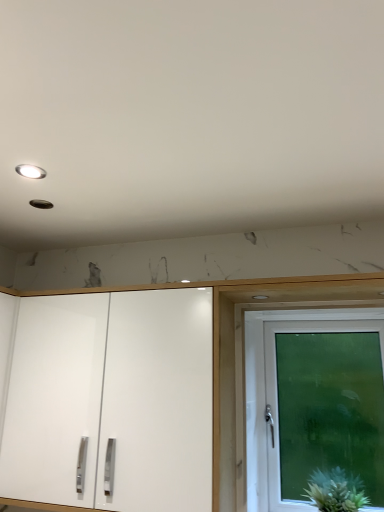
In order to face green fuzzy plant at lower right, should I rotate leftwards or rightwards?

Rotate your view right by about 18.816°.

This screenshot has height=512, width=384. In order to click on matte white light fixture at upper left in this screenshot , I will do `click(31, 170)`.

What are the coordinates of `white glass door at right` in the screenshot? It's located at (324, 405).

Does white glass door at right have a lesser width compared to matte white light fixture at upper left?

Incorrect, the width of white glass door at right is not less than that of matte white light fixture at upper left.

In the image, is white glass door at right on the left side or the right side of matte white light fixture at upper left?

Based on their positions, white glass door at right is located to the right of matte white light fixture at upper left.

Looking at the image, does white glass door at right seem bigger or smaller compared to matte white light fixture at upper left?

In the image, white glass door at right appears to be larger than matte white light fixture at upper left.

Would you say matte white light fixture at upper left is part of white glass door at right's contents?

No, matte white light fixture at upper left is located outside of white glass door at right.

Which object is more forward, green fuzzy plant at lower right or matte white light fixture at upper left?

matte white light fixture at upper left is in front.

From the image's perspective, relative to matte white light fixture at upper left, is green fuzzy plant at lower right above or below?

Clearly, from the image's perspective, green fuzzy plant at lower right is below matte white light fixture at upper left.

Would you say green fuzzy plant at lower right is inside or outside matte white light fixture at upper left?

green fuzzy plant at lower right is outside matte white light fixture at upper left.

From a real-world perspective, is green fuzzy plant at lower right above or below matte white light fixture at upper left?

From a real-world perspective, green fuzzy plant at lower right is physically below matte white light fixture at upper left.

Which of these two, matte white light fixture at upper left or white glass door at right, is smaller?

matte white light fixture at upper left is smaller.

Between matte white light fixture at upper left and white glass door at right, which one has less height?

With less height is matte white light fixture at upper left.

Is matte white light fixture at upper left in front of white glass door at right?

Yes, it is in front of white glass door at right.

Which of these two, white glass door at right or white glossy cabinet doors at center, is bigger?

white glossy cabinet doors at center.

In the scene shown: Is white glass door at right further to the viewer compared to white glossy cabinet doors at center?

Yes.

Would you say white glossy cabinet doors at center is part of white glass door at right's contents?

Actually, white glossy cabinet doors at center is outside white glass door at right.

Is white glass door at right oriented towards white glossy cabinet doors at center?

No, white glass door at right is not facing towards white glossy cabinet doors at center.

From a real-world perspective, which is physically above, white glossy cabinet doors at center or white glass door at right?

From a 3D spatial view, white glossy cabinet doors at center is above.

Is white glossy cabinet doors at center not near white glass door at right?

No, white glossy cabinet doors at center is in close proximity to white glass door at right.

Is the position of white glossy cabinet doors at center more distant than that of white glass door at right?

No, the depth of white glossy cabinet doors at center is less than that of white glass door at right.

Is white glossy cabinet doors at center looking in the opposite direction of white glass door at right?

No, white glossy cabinet doors at center is not facing away from white glass door at right.

Do you think green fuzzy plant at lower right is within white glass door at right, or outside of it?

green fuzzy plant at lower right is located beyond the bounds of white glass door at right.

Does point (346, 479) lie behind point (323, 415)?

No, (346, 479) is in front of (323, 415).

Find the location of `houseplant below the white glass door at right (from the image's perspective)`. houseplant below the white glass door at right (from the image's perspective) is located at coordinates (336, 490).

Can you tell me how much green fuzzy plant at lower right and white glass door at right differ in facing direction?

The facing directions of green fuzzy plant at lower right and white glass door at right are 0.00309 degrees apart.

Does point (10, 489) come farther from viewer compared to point (345, 497)?

No, (10, 489) is in front of (345, 497).

Which is more to the left, white glossy cabinet doors at center or green fuzzy plant at lower right?

From the viewer's perspective, white glossy cabinet doors at center appears more on the left side.

Find the location of a particular element. houseplant behind the white glossy cabinet doors at center is located at coordinates (336, 490).

Which object is closer to the camera taking this photo, white glossy cabinet doors at center or green fuzzy plant at lower right?

white glossy cabinet doors at center.

At what (x,y) coordinates should I click in order to perform the action: click on door behind the matte white light fixture at upper left. Please return your answer as a coordinate pair (x, y). This screenshot has height=512, width=384. Looking at the image, I should click on pos(324,405).

This screenshot has height=512, width=384. What are the coordinates of `houseplant on the right of the matte white light fixture at upper left` in the screenshot? It's located at (336, 490).

Which object lies nearer to the anchor point white glass door at right, matte white light fixture at upper left or green fuzzy plant at lower right?

green fuzzy plant at lower right is positioned closer to the anchor white glass door at right.

Which object lies nearer to the anchor point white glossy cabinet doors at center, green fuzzy plant at lower right or matte white light fixture at upper left?

green fuzzy plant at lower right.

Estimate the real-world distances between objects in this image. Which object is further from white glossy cabinet doors at center, green fuzzy plant at lower right or white glass door at right?

green fuzzy plant at lower right lies further to white glossy cabinet doors at center than the other object.

When comparing their distances from matte white light fixture at upper left, does white glossy cabinet doors at center or white glass door at right seem further?

The object further to matte white light fixture at upper left is white glass door at right.

Considering their positions, is white glass door at right positioned closer to white glossy cabinet doors at center than matte white light fixture at upper left?

Based on the image, white glass door at right appears to be nearer to white glossy cabinet doors at center.

Looking at the image, which one is located closer to matte white light fixture at upper left, white glass door at right or white glossy cabinet doors at center?

white glossy cabinet doors at center.

When comparing their distances from green fuzzy plant at lower right, does matte white light fixture at upper left or white glossy cabinet doors at center seem closer?

white glossy cabinet doors at center is closer to green fuzzy plant at lower right.

Which object lies nearer to the anchor point matte white light fixture at upper left, white glossy cabinet doors at center or green fuzzy plant at lower right?

white glossy cabinet doors at center is positioned closer to the anchor matte white light fixture at upper left.

Where is `houseplant situated between white glossy cabinet doors at center and white glass door at right from left to right`? houseplant situated between white glossy cabinet doors at center and white glass door at right from left to right is located at coordinates (336, 490).

Where is `cabinetry between matte white light fixture at upper left and white glass door at right`? This screenshot has width=384, height=512. cabinetry between matte white light fixture at upper left and white glass door at right is located at coordinates (112, 400).

I want to click on cabinetry between matte white light fixture at upper left and green fuzzy plant at lower right vertically, so click(112, 400).

Identify the location of door between matte white light fixture at upper left and green fuzzy plant at lower right from top to bottom. (324, 405).